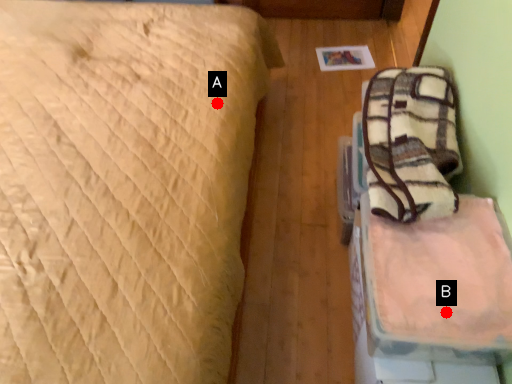
Question: Two points are circled on the image, labeled by A and B beside each circle. Among these points, which one is nearest to the camera?

Choices:
 (A) A is closer
 (B) B is closer

Answer: (B)